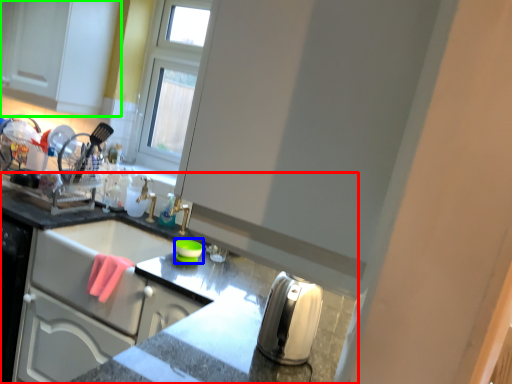
Question: Which object is positioned closest to countertop (highlighted by a red box)? Select from appliance (highlighted by a blue box) and cabinetry (highlighted by a green box).

Choices:
 (A) appliance
 (B) cabinetry

Answer: (A)